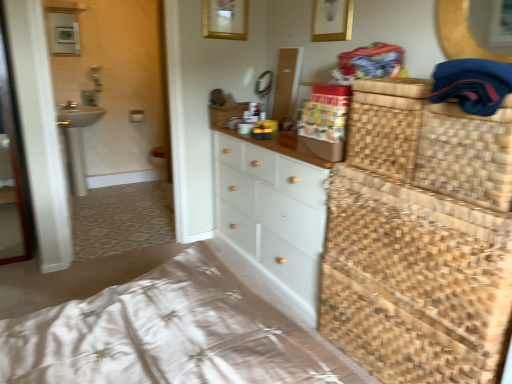
Question: Considering the relative sizes of dark blue fabric at upper right and matte white medicine cabinet at upper left in the image provided, is dark blue fabric at upper right taller than matte white medicine cabinet at upper left?

Choices:
 (A) yes
 (B) no

Answer: (B)

Question: Is dark blue fabric at upper right not close to matte white medicine cabinet at upper left?

Choices:
 (A) yes
 (B) no

Answer: (A)

Question: Is dark blue fabric at upper right oriented towards matte white medicine cabinet at upper left?

Choices:
 (A) yes
 (B) no

Answer: (B)

Question: Is matte white medicine cabinet at upper left surrounded by dark blue fabric at upper right?

Choices:
 (A) no
 (B) yes

Answer: (A)

Question: Considering the relative positions of dark blue fabric at upper right and matte white medicine cabinet at upper left in the image provided, is dark blue fabric at upper right behind matte white medicine cabinet at upper left?

Choices:
 (A) yes
 (B) no

Answer: (B)

Question: Is matte white medicine cabinet at upper left at the back of dark blue fabric at upper right?

Choices:
 (A) no
 (B) yes

Answer: (A)

Question: Can you confirm if woven brown basket at right, positioned as the first basket in right-to-left order, is shorter than gold metallic picture frame at upper center?

Choices:
 (A) yes
 (B) no

Answer: (A)

Question: Is woven brown basket at right, positioned as the 2th basket in top-to-bottom order, oriented away from gold metallic picture frame at upper center?

Choices:
 (A) no
 (B) yes

Answer: (A)

Question: Does woven brown basket at right, positioned as the first basket in right-to-left order, touch gold metallic picture frame at upper center?

Choices:
 (A) yes
 (B) no

Answer: (B)

Question: Is there a large distance between woven brown basket at right, the 2th basket positioned from the back, and gold metallic picture frame at upper center?

Choices:
 (A) yes
 (B) no

Answer: (A)

Question: Is woven brown basket at right, positioned as the first basket in right-to-left order, further to the viewer compared to gold metallic picture frame at upper center?

Choices:
 (A) yes
 (B) no

Answer: (B)

Question: From a real-world perspective, is woven brown basket at right, placed as the second basket when sorted from left to right, positioned under gold metallic picture frame at upper center based on gravity?

Choices:
 (A) yes
 (B) no

Answer: (A)

Question: Is transparent glass screen door at left bigger than woven wood bed frame at lower right?

Choices:
 (A) no
 (B) yes

Answer: (A)